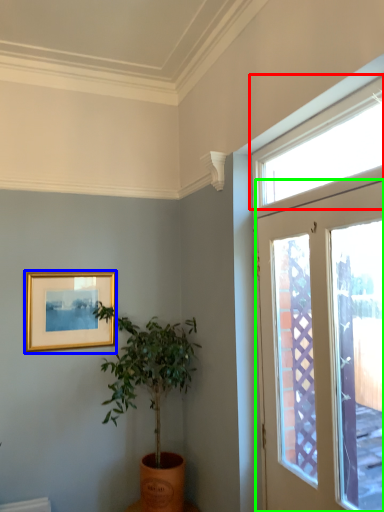
Question: Estimate the real-world distances between objects in this image. Which object is farther from window (highlighted by a red box), picture frame (highlighted by a blue box) or door (highlighted by a green box)?

Choices:
 (A) picture frame
 (B) door

Answer: (A)